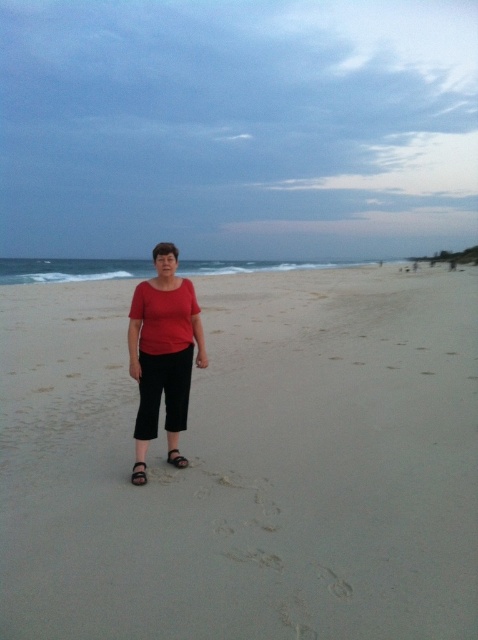
Question: Is the position of sandy at center less distant than that of black leather sandal at center?

Choices:
 (A) no
 (B) yes

Answer: (B)

Question: Estimate the real-world distances between objects in this image. Which object is farther from the black leather sandal at center?

Choices:
 (A) sandy at center
 (B) matte red blouse at center

Answer: (A)

Question: Does matte red blouse at center appear over black leather sandal at lower center?

Choices:
 (A) yes
 (B) no

Answer: (A)

Question: Estimate the real-world distances between objects in this image. Which object is farther from the sandy at center?

Choices:
 (A) matte red blouse at center
 (B) black leather sandal at center
 (C) black leather sandal at lower center

Answer: (C)

Question: Can you confirm if sandy at center is smaller than black leather sandal at center?

Choices:
 (A) no
 (B) yes

Answer: (A)

Question: Which point is closer to the camera?

Choices:
 (A) sandy at center
 (B) black leather sandal at lower center
 (C) matte red blouse at center
 (D) black leather sandal at center

Answer: (A)